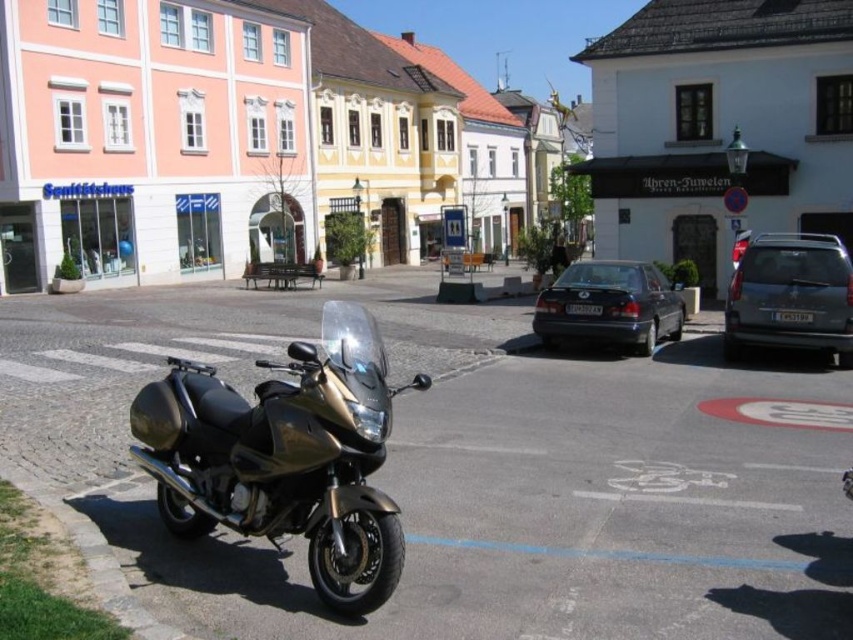
Question: Which point is closer to the camera taking this photo?

Choices:
 (A) (154, 93)
 (B) (601, 317)
 (C) (311, 484)

Answer: (C)

Question: Which is nearer to the metallic gold motorcycle at center?

Choices:
 (A) matte gold motorcycle at lower left
 (B) matte black sedan at center
 (C) metallic gray van at right

Answer: (B)

Question: Can you confirm if matte gold motorcycle at lower left is smaller than metallic gold motorcycle at center?

Choices:
 (A) no
 (B) yes

Answer: (A)

Question: From the image, what is the correct spatial relationship of metallic gold motorcycle at center in relation to metallic gray van at right?

Choices:
 (A) above
 (B) below

Answer: (B)

Question: Which of the following is the farthest from the observer?

Choices:
 (A) click(796, 333)
 (B) click(257, 227)
 (C) click(592, 288)
 (D) click(137, 406)

Answer: (B)

Question: Is metallic gold motorcycle at center smaller than matte black sedan at center?

Choices:
 (A) no
 (B) yes

Answer: (B)